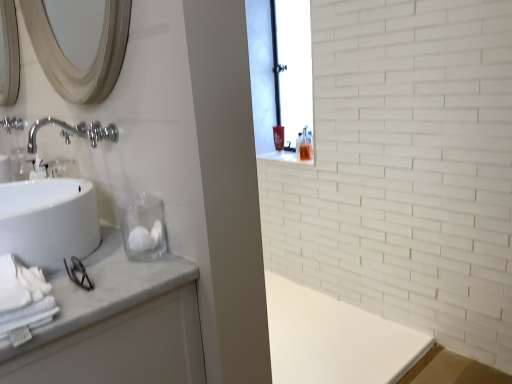
Question: Based on their sizes in the image, would you say white cotton bath towel at lower left is bigger or smaller than white marble bathroom cabinet at left?

Choices:
 (A) big
 (B) small

Answer: (B)

Question: Considering their positions, is white cotton bath towel at lower left located in front of or behind white marble bathroom cabinet at left?

Choices:
 (A) behind
 (B) front

Answer: (B)

Question: Estimate the real-world distances between objects in this image. Which object is farther from the polished chrome faucet at upper left, the 1th plumbing fixture from the right?

Choices:
 (A) white glossy sink at left
 (B) chrome metallic faucet at upper left, placed as the 2th plumbing fixture when sorted from bottom to top
 (C) white cotton bath towel at lower left
 (D) white marble bathroom cabinet at left
 (E) silver metallic mirror at upper left

Answer: (B)

Question: Which object is positioned closest to the white glossy sink at left?

Choices:
 (A) white marble bathroom cabinet at left
 (B) white cotton bath towel at lower left
 (C) chrome metallic faucet at upper left, placed as the 2th plumbing fixture when sorted from bottom to top
 (D) silver metallic mirror at upper left
 (E) polished chrome faucet at upper left, the 2th plumbing fixture from the left

Answer: (E)